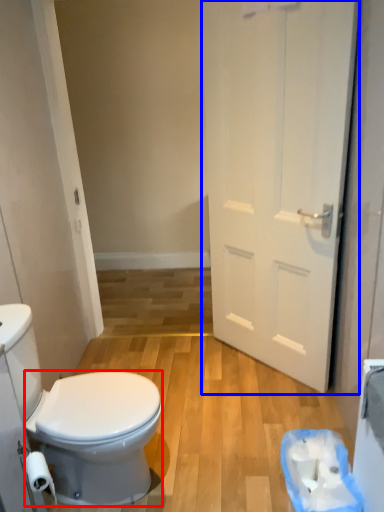
Question: Which object is closer to the camera taking this photo, bidet (highlighted by a red box) or door (highlighted by a blue box)?

Choices:
 (A) bidet
 (B) door

Answer: (A)